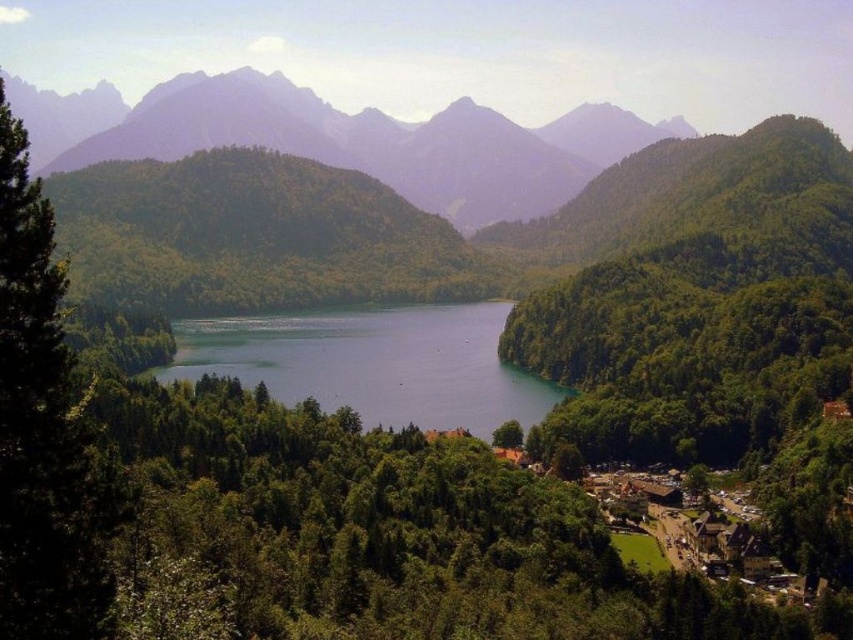
Question: Based on their relative distances, which object is nearer to the green leafy tree at left?

Choices:
 (A) green leafy tree at lower center
 (B) rugged granite mountain at upper center

Answer: (A)

Question: Is the position of rugged granite mountain at upper center less distant than that of green water at center?

Choices:
 (A) no
 (B) yes

Answer: (A)

Question: Is green water at center smaller than green leafy tree at lower center?

Choices:
 (A) no
 (B) yes

Answer: (A)

Question: Can you confirm if green leafy tree at left is wider than green water at center?

Choices:
 (A) yes
 (B) no

Answer: (B)

Question: Which point is closer to the camera taking this photo?

Choices:
 (A) (505, 440)
 (B) (231, 346)
 (C) (38, 179)
 (D) (78, 160)

Answer: (C)

Question: Which object appears closest to the camera in this image?

Choices:
 (A) green leafy tree at lower center
 (B) rugged granite mountain at upper center

Answer: (A)